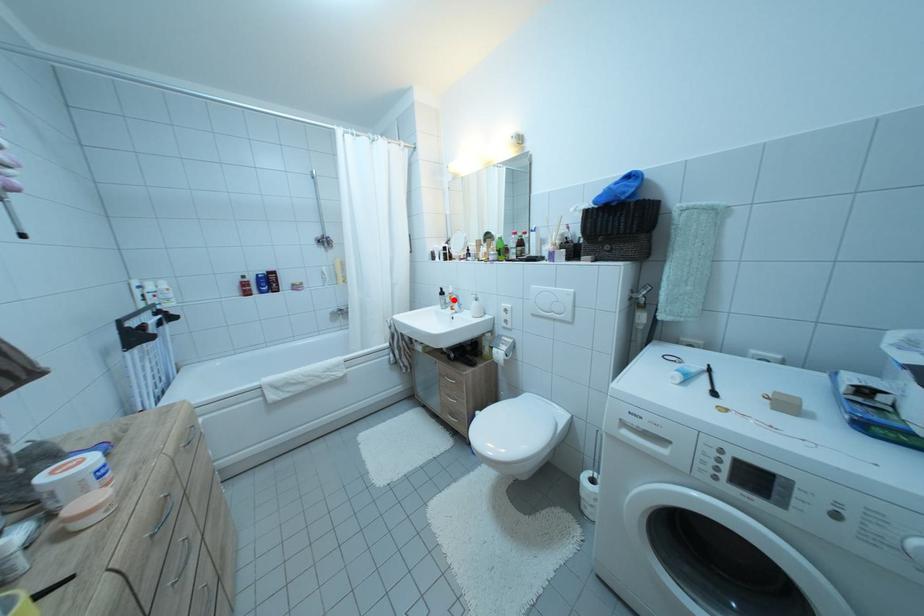
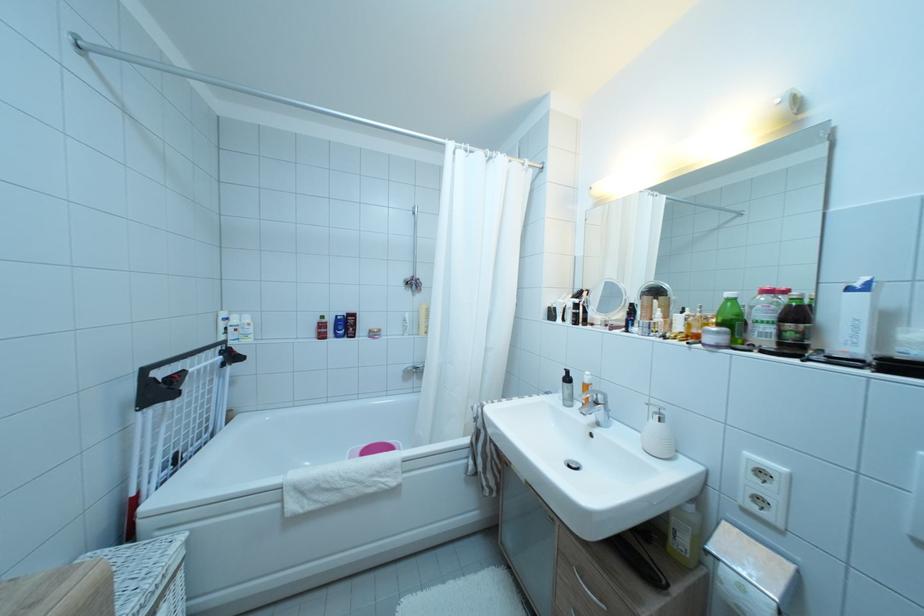
Where in the second image is the point corresponding to the highlighted location from the first image?

(585, 390)